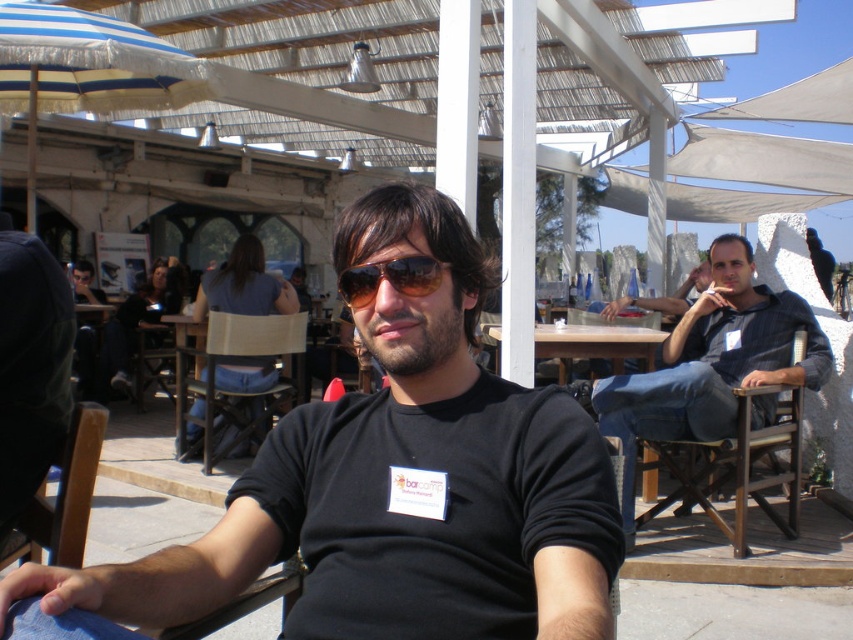
Question: Estimate the real-world distances between objects in this image. Which object is farther from the wooden chair at center?

Choices:
 (A) black matte shirt at center
 (B) wooden chair at left
 (C) wooden table at center
 (D) sunglasses at center

Answer: (D)

Question: Is burlap fabric chair at center above wooden table at center?

Choices:
 (A) yes
 (B) no

Answer: (B)

Question: From the image, what is the correct spatial relationship of black matte shirt at center in relation to wooden chair at left?

Choices:
 (A) above
 (B) below

Answer: (A)

Question: Which is nearer to the burlap fabric chair at center?

Choices:
 (A) wooden chair at left
 (B) black matte shirt at center
 (C) wooden chair at right

Answer: (C)

Question: From the image, what is the correct spatial relationship of wooden chair at right in relation to sunglasses at center?

Choices:
 (A) above
 (B) below

Answer: (B)

Question: Which of the following is the closest to the observer?

Choices:
 (A) burlap fabric chair at center
 (B) wooden chair at right

Answer: (B)